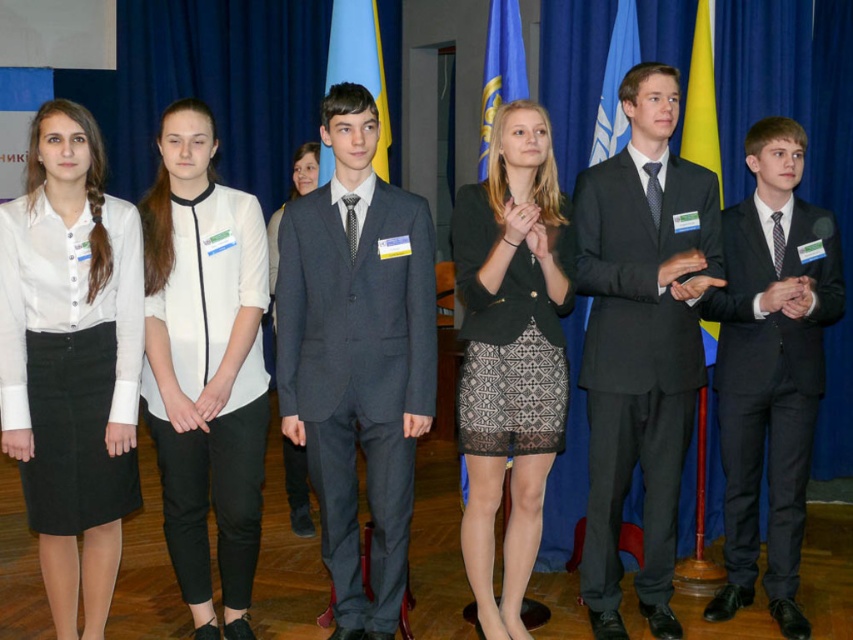
You are organizing a photo shoot and need to arrange two individuals wearing the dark gray suit at center and the matte black suit at center so that their heights are proportionate to their clothing colors. Which individual should stand in front to ensure the taller person is not blocking the shorter one?

The dark gray suit at center is shorter than the matte black suit at center. To prevent the taller matte black suit at center from blocking the shorter dark gray suit at center, the shorter dark gray suit at center should be placed in front.

In the scene shown: You are organizing a photo shoot and need to arrange two outfits from the image on a mannequin stand. The stand can only accommodate items with a combined width of up to 1.2 meters. Given that the matte black suit at center is wider than the matte black dress at center, can both items be placed on the stand together?

The matte black suit at center is wider than the matte black dress at center, but without knowing their exact widths, it is impossible to determine if their combined width exceeds 1.2 meters. Additional measurements are needed to confirm.

You are a photographer standing at the event. You want to take a photo of the matte black suit at center from where you are standing. The camera requires a minimum distance of 3 meters to focus properly. Can you take a clear photo from your current position?

The distance between the matte black suit at center and the camera is 2.95 meters, which is less than the required 3 meters. Therefore, you cannot take a clear photo from your current position.